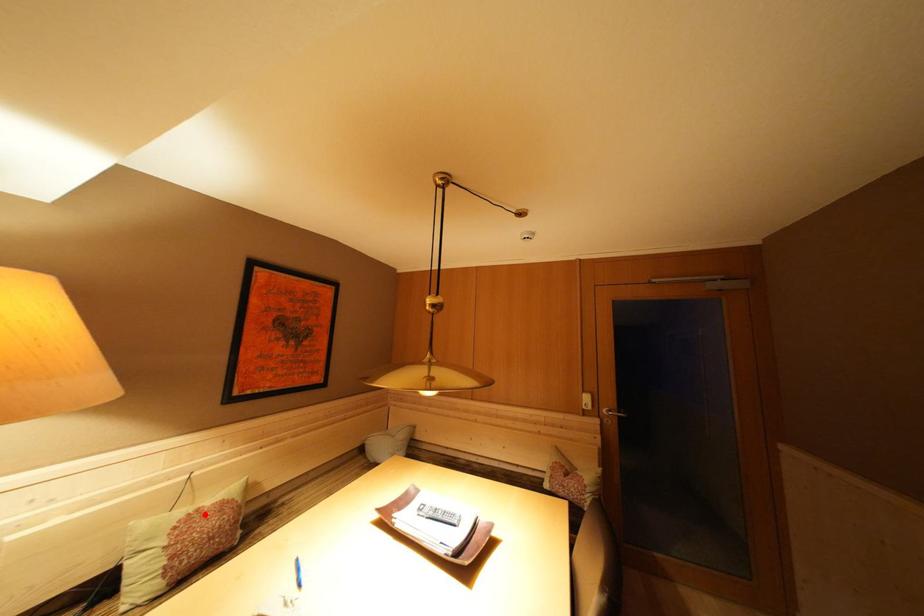
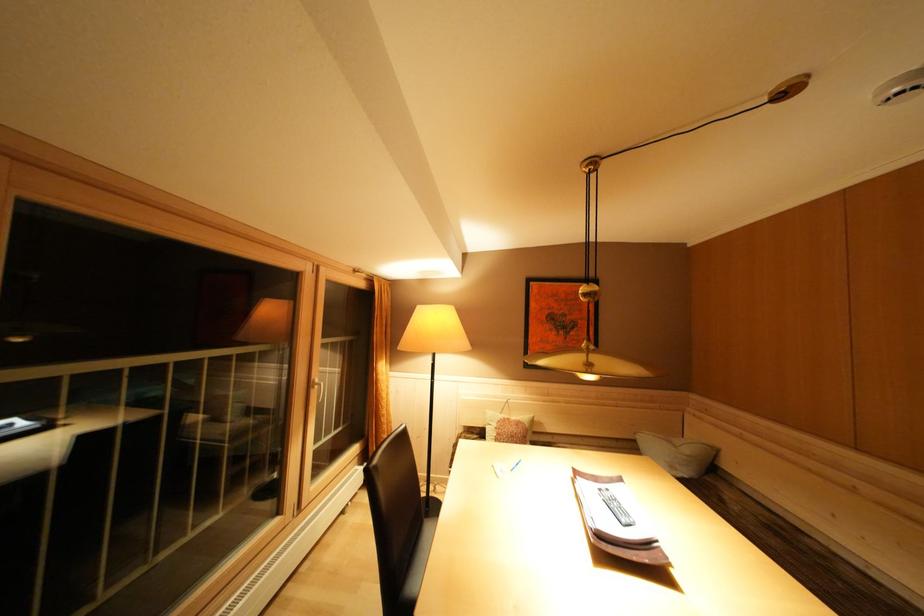
In the second image, find the point that corresponds to the highlighted location in the first image.

(515, 424)